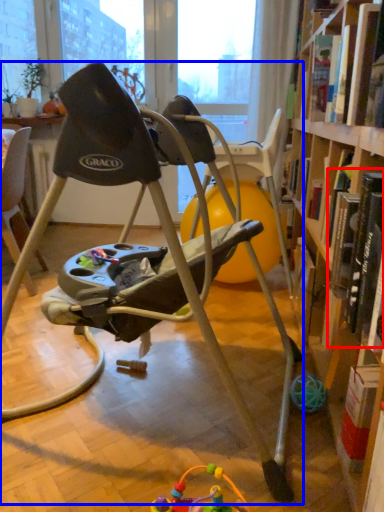
Question: Among these objects, which one is farthest to the camera, book (highlighted by a red box) or chair (highlighted by a blue box)?

Choices:
 (A) book
 (B) chair

Answer: (A)